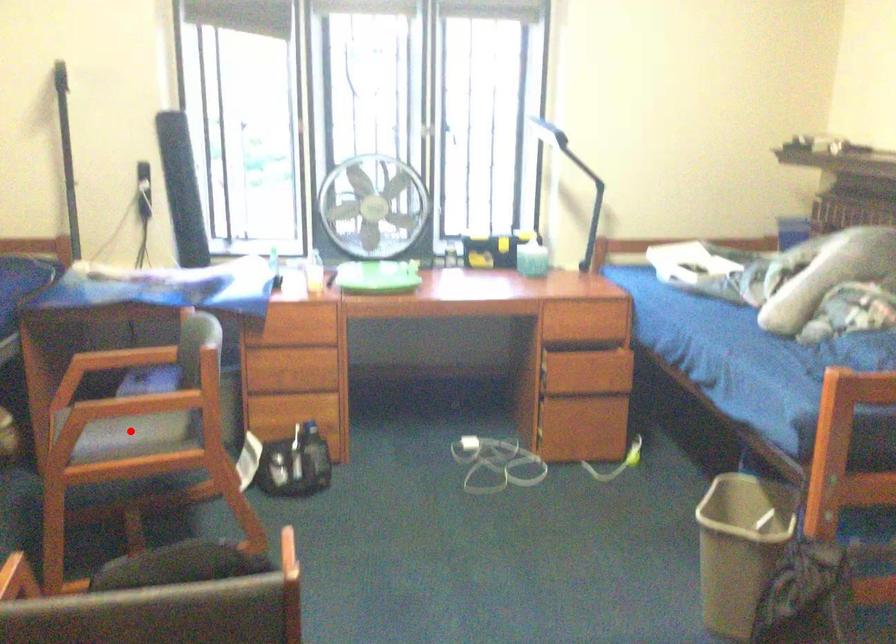
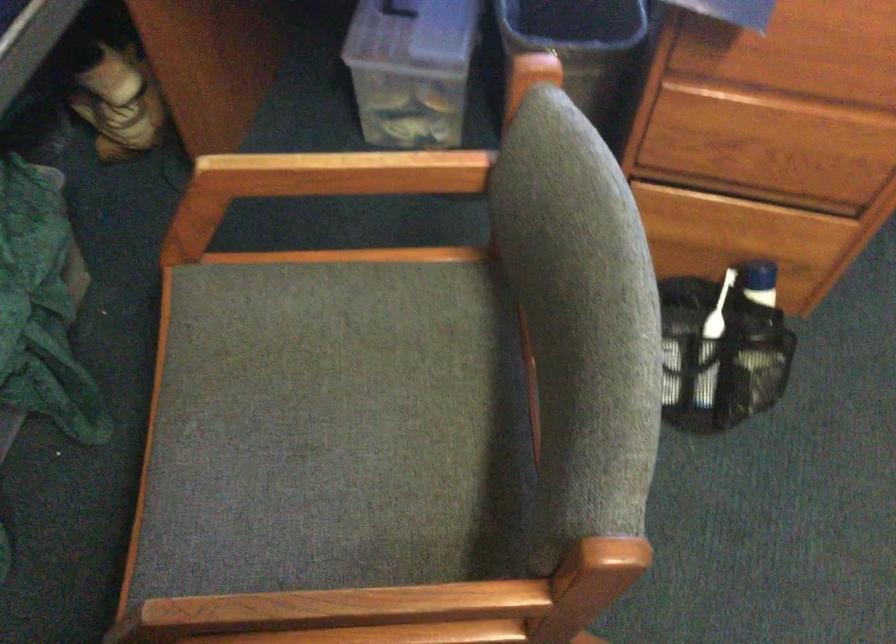
Question: I am providing you with two images of the same scene from different viewpoints. Image1 has a red point marked. In image2, the corresponding 3D location appears at what relative position? Reply with the corresponding letter.

Choices:
 (A) Closer
 (B) Farther

Answer: (A)